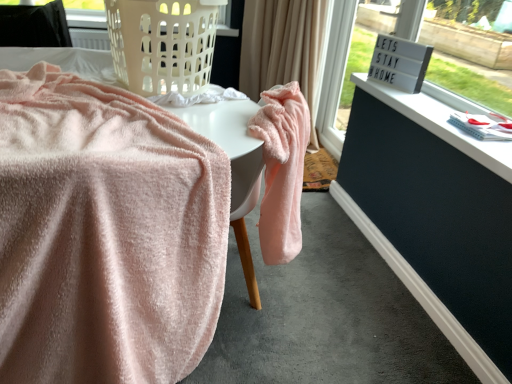
This screenshot has width=512, height=384. I want to click on empty space that is ontop of black fabric at upper left (from a real-world perspective), so click(x=29, y=7).